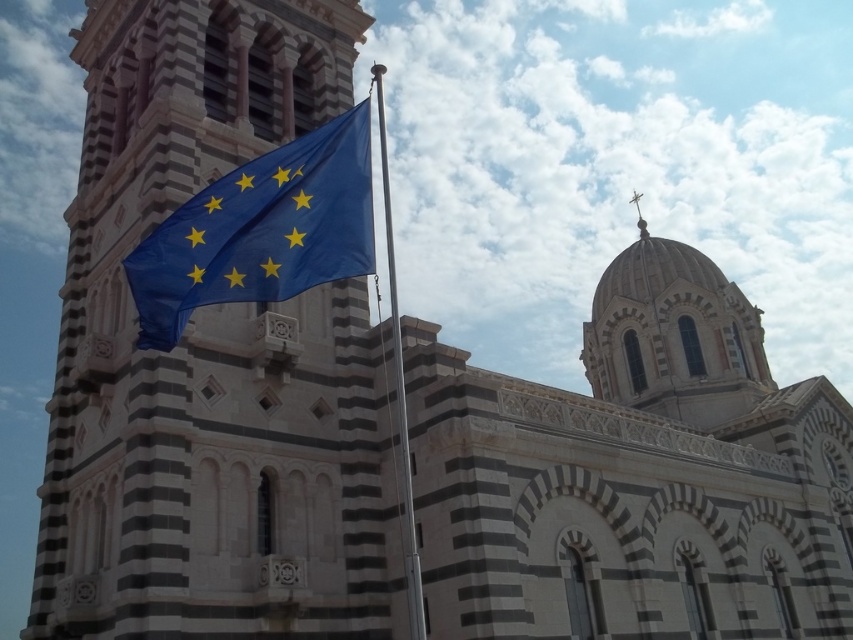
Who is positioned more to the right, marble tower at center or blue fabric flagpole at center?

blue fabric flagpole at center

Is marble tower at center below blue fabric flagpole at center?

Yes, marble tower at center is below blue fabric flagpole at center.

Where is `marble tower at center`? marble tower at center is located at coordinates (206, 355).

Describe the element at coordinates (206, 355) in the screenshot. The width and height of the screenshot is (853, 640). I see `marble tower at center` at that location.

Is marble tower at center to the right of blue fabric flag at center from the viewer's perspective?

Incorrect, marble tower at center is not on the right side of blue fabric flag at center.

Who is more distant from viewer, (132,144) or (178,259)?

The point (132,144) is behind.

The width and height of the screenshot is (853, 640). I want to click on marble tower at center, so click(x=206, y=355).

Does blue fabric flag at center appear on the left side of blue fabric flagpole at center?

Indeed, blue fabric flag at center is positioned on the left side of blue fabric flagpole at center.

Looking at this image, does blue fabric flag at center have a larger size compared to blue fabric flagpole at center?

No.

Is point (346, 195) positioned behind point (422, 632)?

Yes, point (346, 195) is behind point (422, 632).

Where is `blue fabric flag at center`? Image resolution: width=853 pixels, height=640 pixels. blue fabric flag at center is located at coordinates (260, 230).